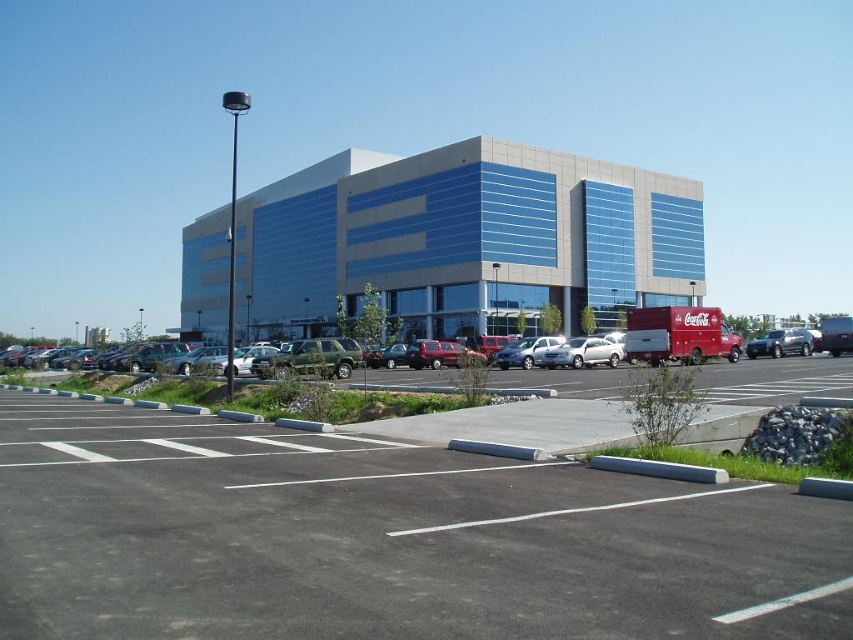
Question: Is shiny silver sedan at right below satin silver sedan at center?

Choices:
 (A) no
 (B) yes

Answer: (B)

Question: Which of the following is the farthest from the observer?

Choices:
 (A) (740, 580)
 (B) (531, 353)
 (C) (616, 342)

Answer: (C)

Question: Does black asphalt parking lot at center have a smaller size compared to silver metallic sedan at center?

Choices:
 (A) yes
 (B) no

Answer: (A)

Question: Among these objects, which one is farthest from the camera?

Choices:
 (A) silver metallic sedan at center
 (B) black asphalt parking lot at center

Answer: (A)

Question: Which object is closer to the camera taking this photo?

Choices:
 (A) black asphalt parking lot at center
 (B) satin silver sedan at center

Answer: (A)

Question: Does silver metallic sedan at center have a greater width compared to shiny silver sedan at right?

Choices:
 (A) yes
 (B) no

Answer: (B)